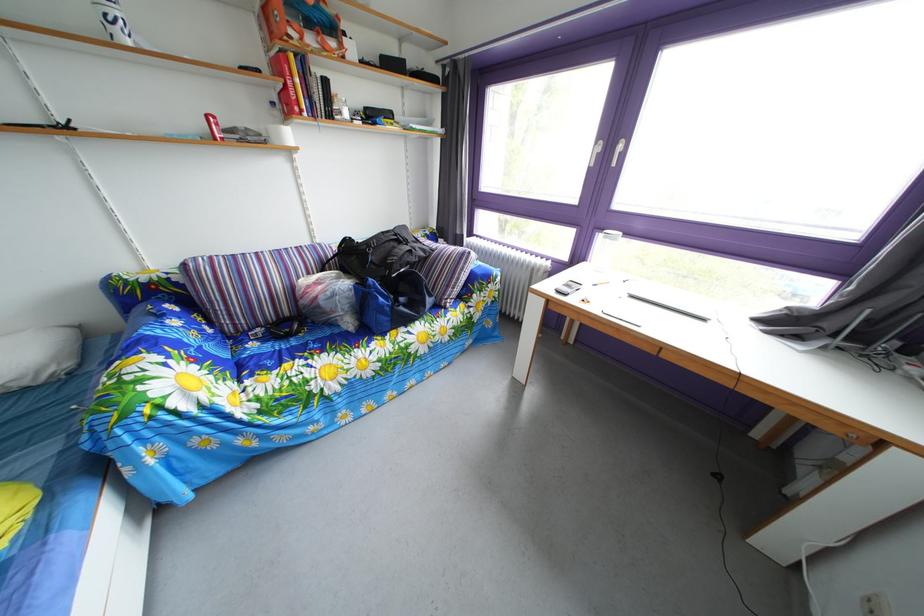
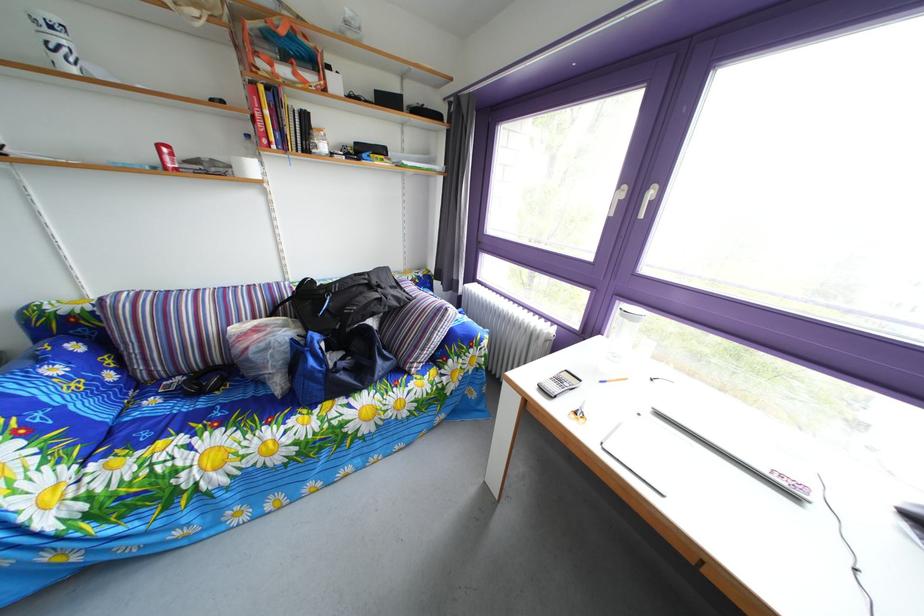
The images are taken continuously from a first-person perspective. In which direction are you moving?

The cameraman moved toward right, forward.